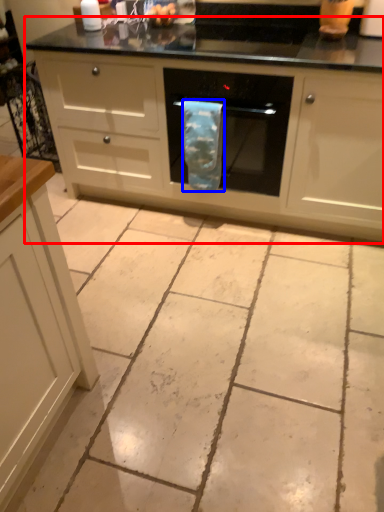
Question: Which point is further to the camera, oven (highlighted by a red box) or material (highlighted by a blue box)?

Choices:
 (A) oven
 (B) material

Answer: (B)